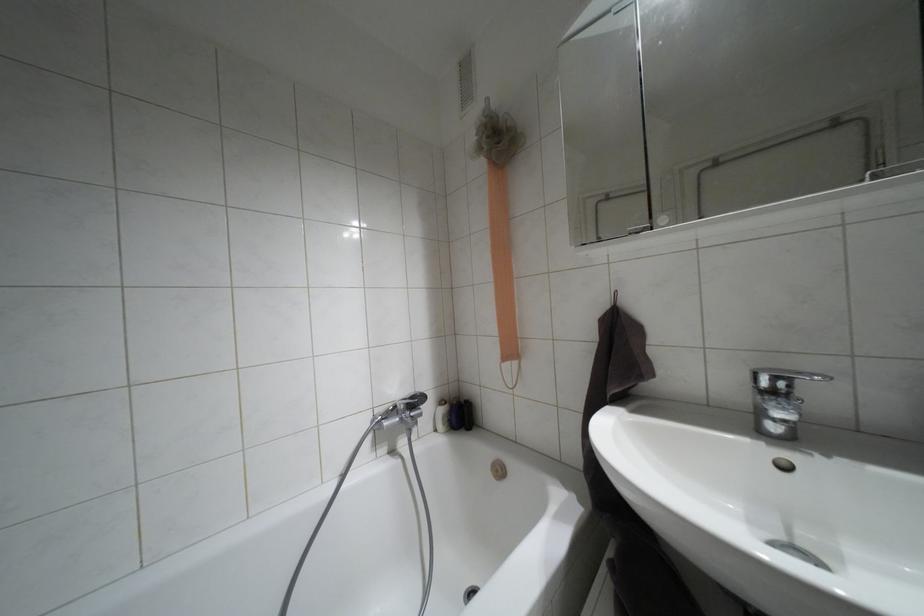
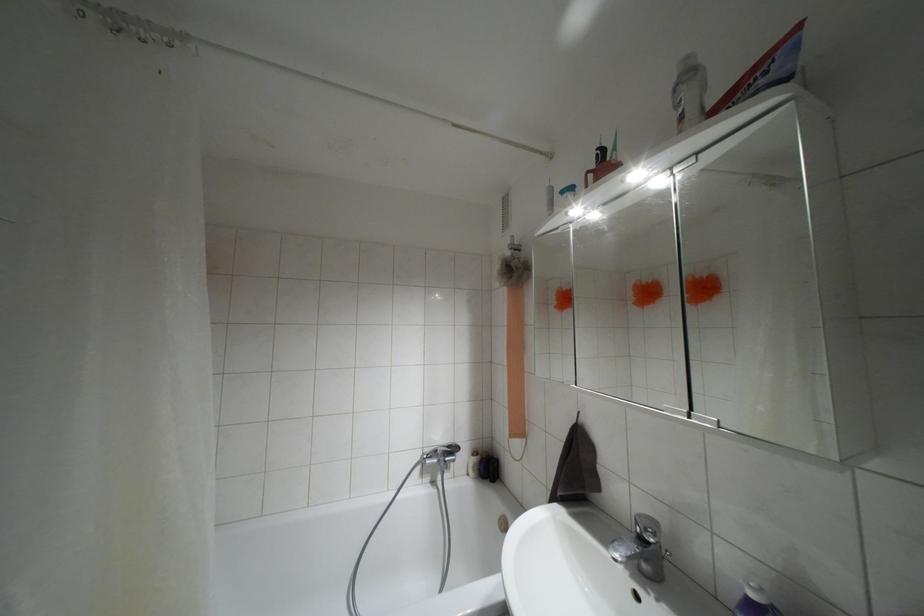
Where in the second image is the point corresponding to pixel 410 397 from the first image?

(447, 446)